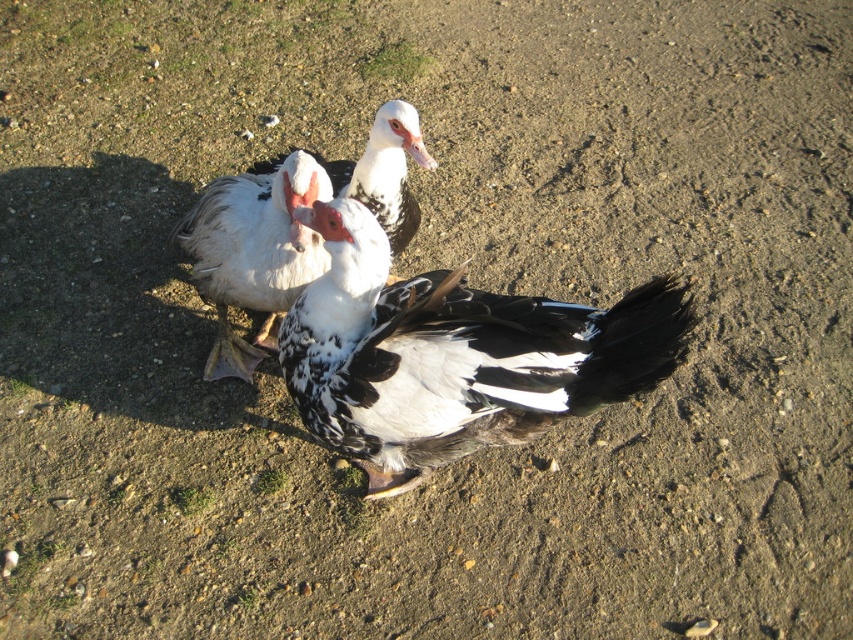
Question: Does speckled feathered goose at center have a lesser width compared to white speckled feather at center?

Choices:
 (A) no
 (B) yes

Answer: (A)

Question: Among these points, which one is nearest to the camera?

Choices:
 (A) (349, 456)
 (B) (225, 323)

Answer: (A)

Question: Which point is closer to the camera taking this photo?

Choices:
 (A) (361, 173)
 (B) (635, 380)

Answer: (B)

Question: Can you confirm if speckled feathered goose at center is smaller than white speckled feather at center?

Choices:
 (A) yes
 (B) no

Answer: (A)

Question: Does speckled feathered goose at center have a larger size compared to white speckled feather at center?

Choices:
 (A) yes
 (B) no

Answer: (B)